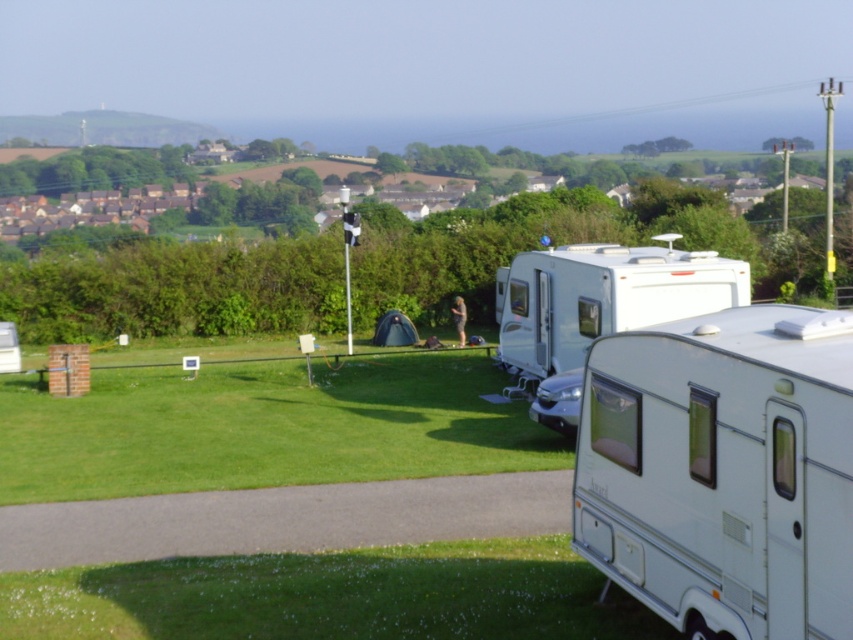
Between white glossy camper at center and white glossy caravan at center, which one is positioned higher?

white glossy caravan at center is above.

Is white glossy camper at center bigger than white glossy caravan at center?

Actually, white glossy camper at center might be smaller than white glossy caravan at center.

Describe the element at coordinates (723, 470) in the screenshot. I see `white glossy camper at center` at that location.

Identify the location of white glossy camper at center. (723, 470).